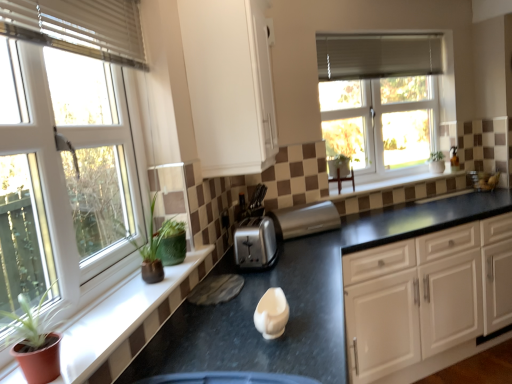
Find the location of a particular element. vacant space behind green matte plant at left is located at coordinates (91, 336).